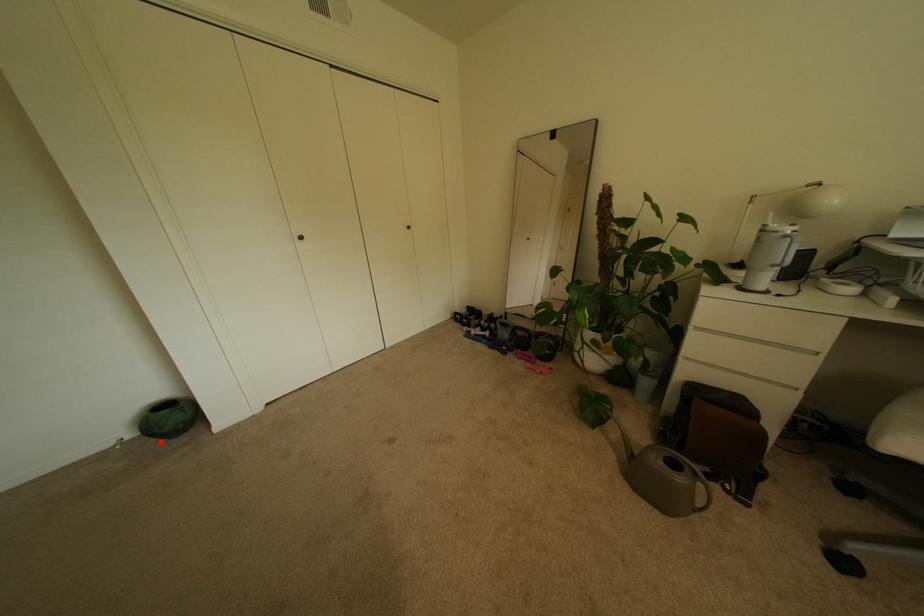
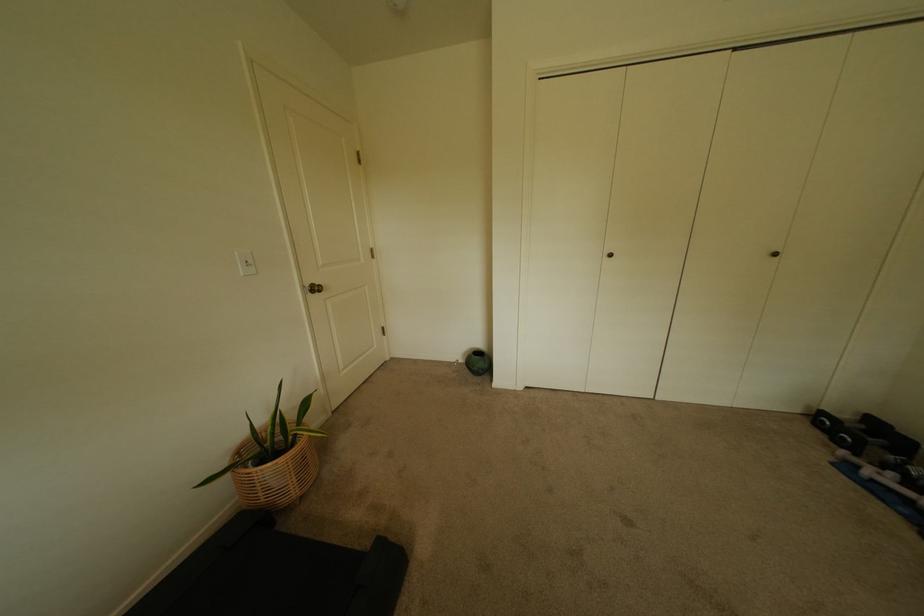
Find the pixel in the second image that matches the highlighted location in the first image.

(476, 371)